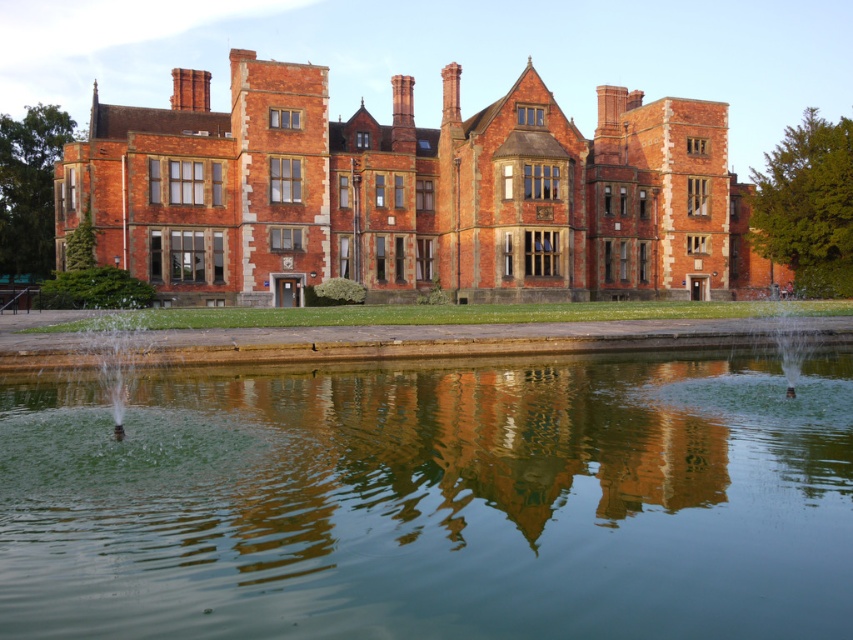
You are standing on the lawn in front of the matte brick mansion at center and the clear water fountain at lower right. Which object is located to the right of the other?

The clear water fountain at lower right is located to the right of the matte brick mansion at center.

You are standing on the lawn in front of the historic building. There is a green reflective water at center marked by point [433,500]. Where is the green reflective water at center located relative to the building?

The green reflective water at center is located at point [433,500], which is in the center of the image. Since the building is in the background, the green reflective water at center is positioned in front of the building.